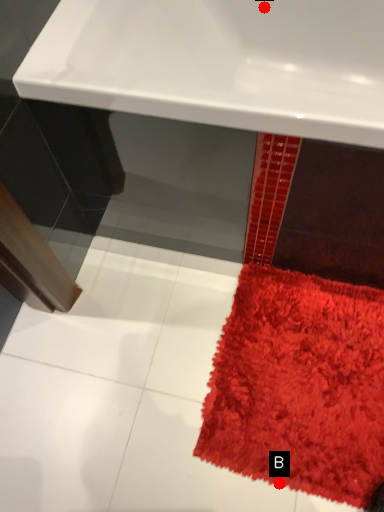
Question: Two points are circled on the image, labeled by A and B beside each circle. Which point is closer to the camera taking this photo?

Choices:
 (A) A is closer
 (B) B is closer

Answer: (B)